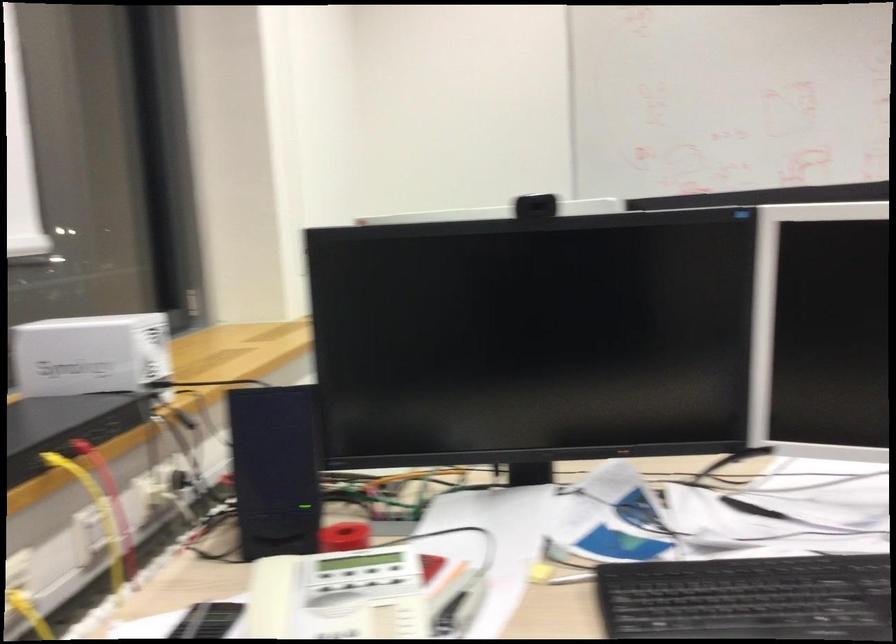
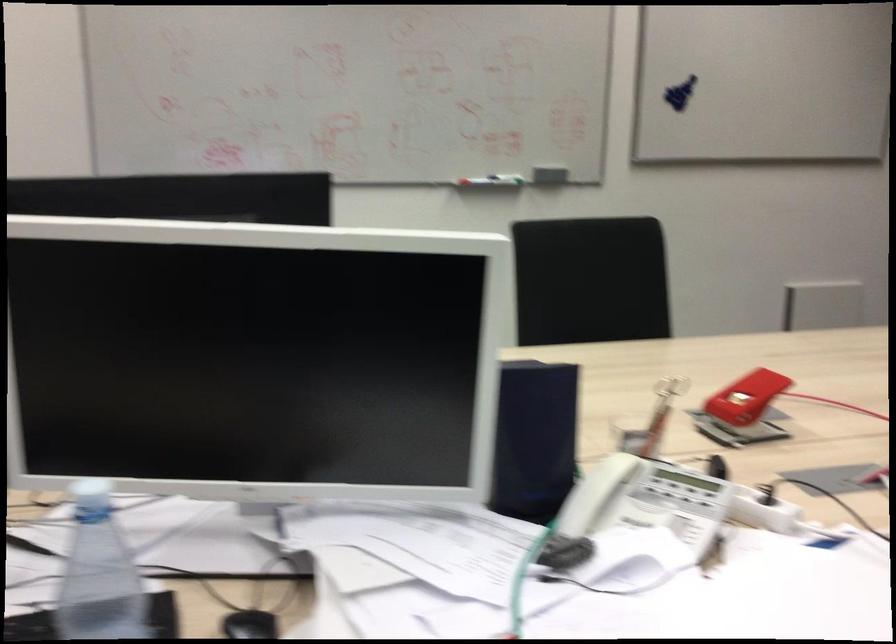
Question: In a continuous first-person perspective shot, in which direction is the camera moving?

Choices:
 (A) Left
 (B) Right
 (C) Forward
 (D) Backward

Answer: (B)